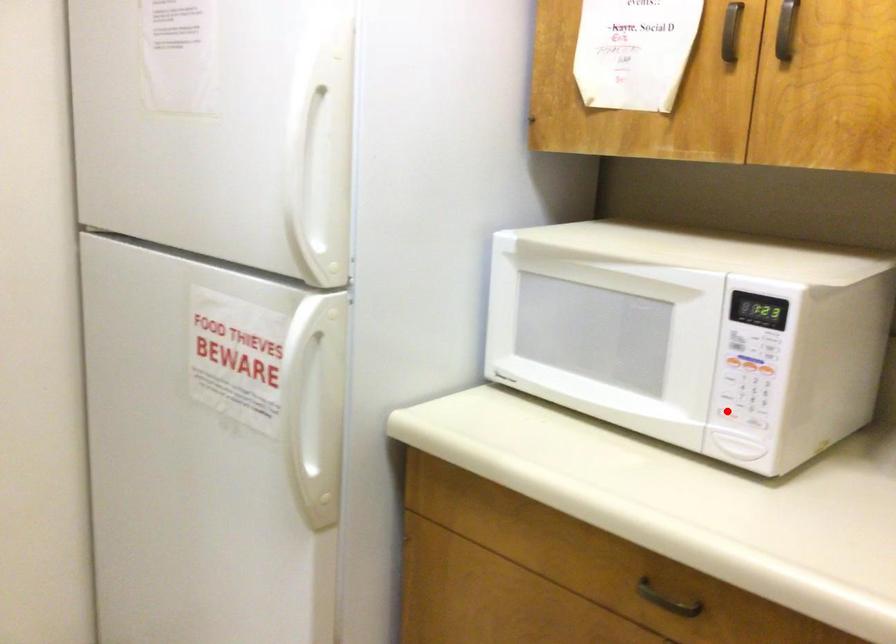
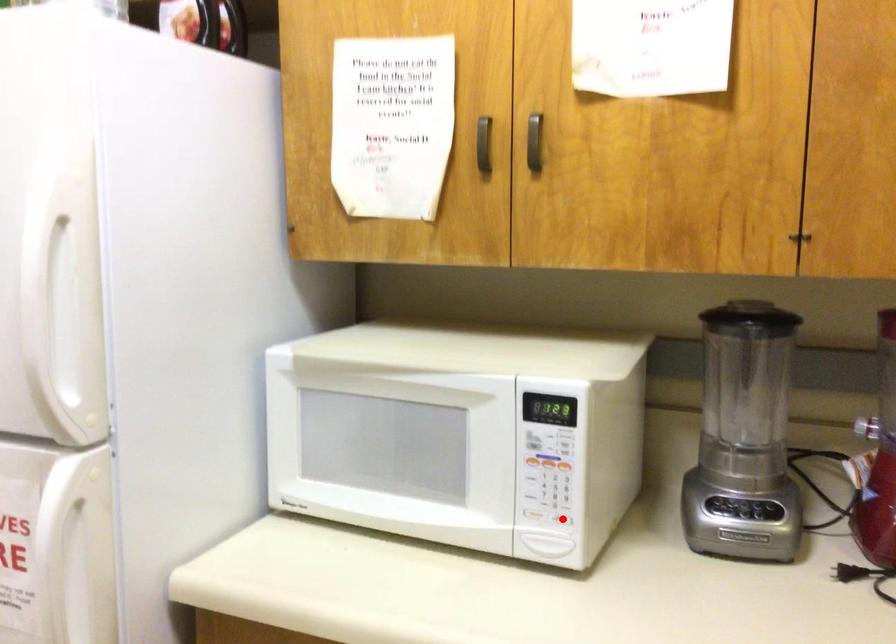
I am providing you with two images of the same scene from different viewpoints. A red point is marked on the first image and another point is marked on the second image. Does the point marked in image1 correspond to the same location as the one in image2?

No